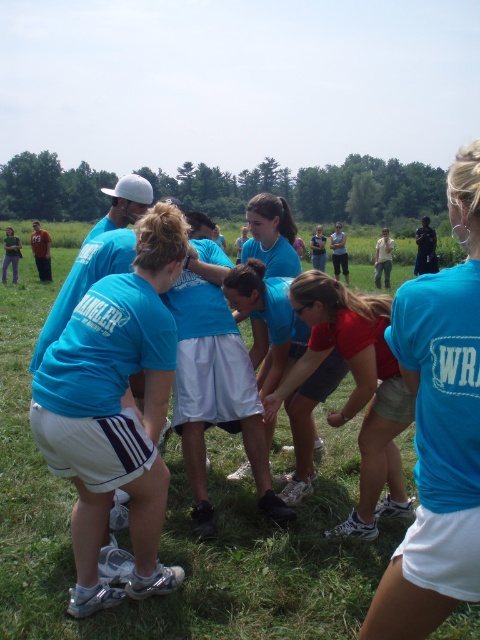
You are standing in the grassy field where the team is gathered. You need to place a small flag exactly at the center of the green grass at center. According to the coordinates provided, where should you place the flag?

The green grass at center should have the flag placed at coordinates point (177, 518) as specified in the description.

You are a photographer standing behind the group of people in the grassy field. You want to capture a photo where the green grass at center is visible above the matte blue shirt at center. Is this possible based on their current positions?

Yes, because the green grass at center is already positioned above the matte blue shirt at center according to the description.

You are a photographer trying to capture a clear shot of the matte blue shirt at center without the green grass at center blocking it. What adjustment should you make to your camera angle?

Since the green grass at center is taller than the matte blue shirt at center, you should lower your camera angle to avoid the grass blocking the view of the matte blue shirt at center.